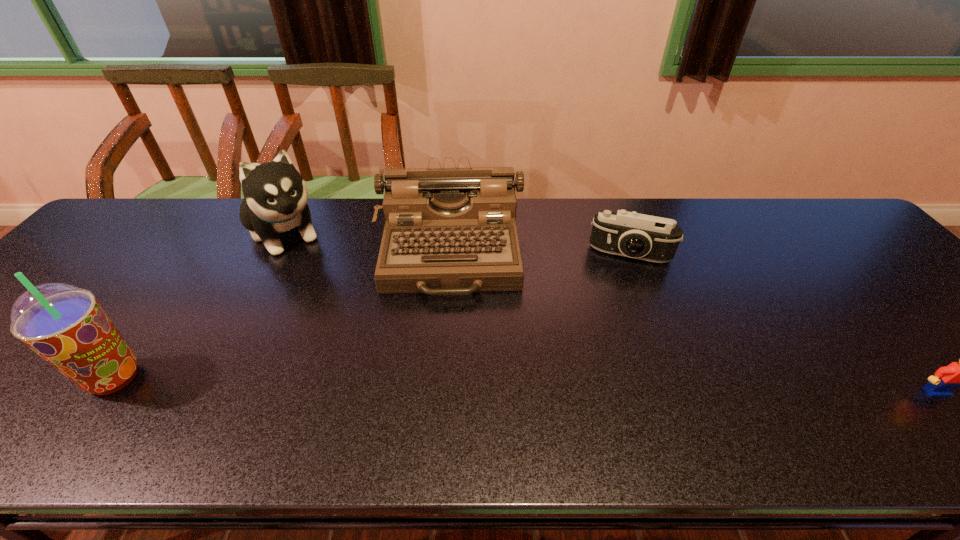
The image size is (960, 540). I want to click on smoothie, so click(64, 324).

Locate an element on the screen. This screenshot has width=960, height=540. Lego is located at coordinates (957, 374).

Where is `the rightmost object`? the rightmost object is located at coordinates (957, 374).

At what (x,y) coordinates should I click in order to perform the action: click on camera. Please return your answer as a coordinate pair (x, y). This screenshot has width=960, height=540. Looking at the image, I should click on (630, 234).

This screenshot has height=540, width=960. I want to click on the third shortest object, so click(448, 231).

Find the location of `typewriter`. typewriter is located at coordinates point(448,231).

Identify the location of the fourth object from right to left. (275, 194).

The height and width of the screenshot is (540, 960). I want to click on vacant region located 0.140m on the back of the leftmost object, so click(165, 308).

You are a GUI agent. You are given a task and a screenshot of the screen. Output one action in this format:
    pyautogui.click(x=<x>, y=<y>)
    Task: Click on the free space located on the front lens of the fourth object from left to right
    The width and height of the screenshot is (960, 540).
    Given the screenshot: What is the action you would take?
    pyautogui.click(x=605, y=387)

The height and width of the screenshot is (540, 960). Find the location of `vacant space situated on the front lens of the fourth object from left to right`. vacant space situated on the front lens of the fourth object from left to right is located at coordinates (607, 372).